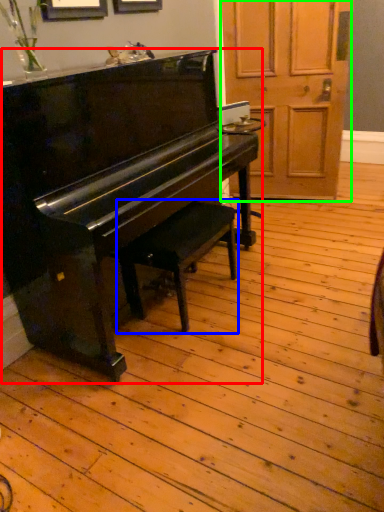
Question: Which object is positioned farthest from piano (highlighted by a red box)? Select from music stool (highlighted by a blue box) and screen door (highlighted by a green box).

Choices:
 (A) music stool
 (B) screen door

Answer: (B)